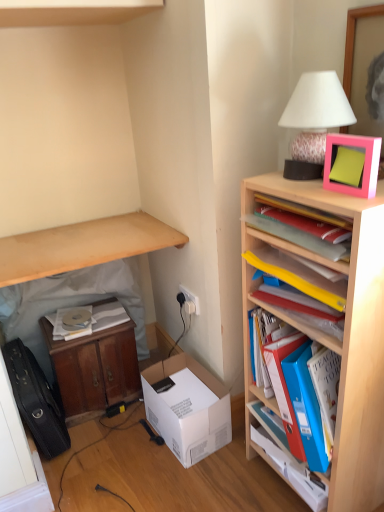
What do you see at coordinates (35, 400) in the screenshot? Image resolution: width=384 pixels, height=512 pixels. I see `black leather suitcase at lower left` at bounding box center [35, 400].

You are a GUI agent. You are given a task and a screenshot of the screen. Output one action in this format:
    pyautogui.click(x=<x>, y=<y>)
    Task: Click on the white plastic electric outlet at center
    
    Given the screenshot: What is the action you would take?
    (x=191, y=297)

What is the approximate height of yellow plastic folders at upper right, which appears as the 1th shelf when viewed from the top?

It is 3.14 inches.

The height and width of the screenshot is (512, 384). In order to click on wooden bookshelf at right, placed as the 2th shelf when sorted from top to bottom in this screenshot , I will do `click(344, 328)`.

From the image's perspective, does light wood shelf at upper left appear lower than blue plastic cabinet at right?

Actually, light wood shelf at upper left appears above blue plastic cabinet at right in the image.

Considering the positions of objects light wood shelf at upper left and blue plastic cabinet at right in the image provided, who is more to the right, light wood shelf at upper left or blue plastic cabinet at right?

blue plastic cabinet at right.

Can you tell me how much light wood shelf at upper left and blue plastic cabinet at right differ in facing direction?

86.8 degrees separate the facing orientations of light wood shelf at upper left and blue plastic cabinet at right.

Choose the correct answer: Is light wood shelf at upper left inside blue plastic cabinet at right or outside it?

light wood shelf at upper left cannot be found inside blue plastic cabinet at right.

Is wooden cabinet at lower left, the 1th table when ordered from right to left, a part of wooden cabinet at lower left, which ranks as the first table in left-to-right order?

Yes, wooden cabinet at lower left, the 1th table when ordered from right to left, is inside wooden cabinet at lower left, which ranks as the first table in left-to-right order.

Is wooden cabinet at lower left, which ranks as the first table in left-to-right order, oriented away from wooden cabinet at lower left, which is counted as the second table, starting from the left?

Yes, wooden cabinet at lower left, which is counted as the second table, starting from the left, is at the back of wooden cabinet at lower left, which ranks as the first table in left-to-right order.

From a real-world perspective, is wooden cabinet at lower left, which ranks as the first table in left-to-right order, physically above wooden cabinet at lower left, the 1th table when ordered from right to left?

Yes, from a real-world perspective, wooden cabinet at lower left, which ranks as the first table in left-to-right order, is on top of wooden cabinet at lower left, the 1th table when ordered from right to left.

From their relative heights in the image, would you say wooden cabinet at lower left, which ranks as the first table in left-to-right order, is taller or shorter than wooden cabinet at lower left, which is counted as the second table, starting from the left?

Considering their sizes, wooden cabinet at lower left, which ranks as the first table in left-to-right order, has more height than wooden cabinet at lower left, which is counted as the second table, starting from the left.

From a real-world perspective, is wooden cabinet at lower left, the 1th table when ordered from right to left, below wooden cabinet at lower left, which ranks as the first table in left-to-right order?

Yes, from a real-world perspective, wooden cabinet at lower left, the 1th table when ordered from right to left, is under wooden cabinet at lower left, which ranks as the first table in left-to-right order.

Is wooden cabinet at lower left, the 1th table when ordered from right to left, shorter than wooden cabinet at lower left, which ranks as the first table in left-to-right order?

Yes, wooden cabinet at lower left, the 1th table when ordered from right to left, is shorter than wooden cabinet at lower left, which ranks as the first table in left-to-right order.

Can you confirm if wooden cabinet at lower left, the 1th table when ordered from right to left, is bigger than wooden cabinet at lower left, which ranks as the first table in left-to-right order?

No.

Considering the relative sizes of wooden cabinet at lower left, which is counted as the second table, starting from the left, and wooden cabinet at lower left, which ranks as the first table in left-to-right order, in the image provided, is wooden cabinet at lower left, which is counted as the second table, starting from the left, thinner than wooden cabinet at lower left, which ranks as the first table in left-to-right order,?

Incorrect, the width of wooden cabinet at lower left, which is counted as the second table, starting from the left, is not less than that of wooden cabinet at lower left, which ranks as the first table in left-to-right order.

Is white cardboard box at lower center touching blue plastic cabinet at right?

No, white cardboard box at lower center is not beside blue plastic cabinet at right.

Looking at this image, does white cardboard box at lower center have a greater height compared to blue plastic cabinet at right?

Yes.

The height and width of the screenshot is (512, 384). In order to click on box behind the blue plastic cabinet at right in this screenshot , I will do `click(187, 407)`.

Which of these two, white cardboard box at lower center or blue plastic cabinet at right, is bigger?

white cardboard box at lower center.

Based on the photo, how many degrees apart are the facing directions of white paper at lower left, arranged as the first book when ordered from the bottom, and white matte table lamp at upper right?

white paper at lower left, arranged as the first book when ordered from the bottom, and white matte table lamp at upper right are facing 85.4 degrees away from each other.

Is white paper at lower left, arranged as the first book when ordered from the bottom, in front of or behind white matte table lamp at upper right in the image?

white paper at lower left, arranged as the first book when ordered from the bottom, is positioned farther from the viewer than white matte table lamp at upper right.

In terms of height, does white paper at lower left, the 1th book when ordered from left to right, look taller or shorter compared to white matte table lamp at upper right?

In the image, white paper at lower left, the 1th book when ordered from left to right, appears to be shorter than white matte table lamp at upper right.

Consider the image. Does white paper at lower left, which ranks as the second book in front-to-back order, turn towards white matte table lamp at upper right?

No, white paper at lower left, which ranks as the second book in front-to-back order, is not facing towards white matte table lamp at upper right.

Which object is further away from the camera, blue plastic folders at right, which ranks as the first shelf in bottom-to-top order, or pink plastic frame at upper right, marked as the 2th book in a left-to-right arrangement?

blue plastic folders at right, which ranks as the first shelf in bottom-to-top order, is further from the camera.

Is pink plastic frame at upper right, which is the second book in bottom-to-top order, located within blue plastic folders at right, which appears as the 3th shelf when viewed from the top?

No, pink plastic frame at upper right, which is the second book in bottom-to-top order, is not a part of blue plastic folders at right, which appears as the 3th shelf when viewed from the top.

Find the location of a particular element. the 3rd shelf positioned below the pink plastic frame at upper right, the first book positioned from the right (from a real-world perspective) is located at coordinates (306, 406).

Is wooden cabinet at lower left, the 1th table when ordered from right to left, oriented towards pink matte picture frame at upper right?

No, wooden cabinet at lower left, the 1th table when ordered from right to left, is not aimed at pink matte picture frame at upper right.

Looking at this image, what's the angular difference between wooden cabinet at lower left, which is counted as the second table, starting from the left, and pink matte picture frame at upper right's facing directions?

wooden cabinet at lower left, which is counted as the second table, starting from the left, and pink matte picture frame at upper right are facing 84.1 degrees away from each other.

Is wooden cabinet at lower left, the 1th table when ordered from right to left, behind pink matte picture frame at upper right?

Yes, it is.

Looking at this image, would you say wooden cabinet at lower left, the 1th table when ordered from right to left, is inside or outside pink matte picture frame at upper right?

wooden cabinet at lower left, the 1th table when ordered from right to left, cannot be found inside pink matte picture frame at upper right.

You are a GUI agent. You are given a task and a screenshot of the screen. Output one action in this format:
    pyautogui.click(x=<x>, y=<y>)
    Task: Click on the desk that appears above the blue plastic cabinet at right (from the image's perspective)
    The image size is (384, 512).
    Given the screenshot: What is the action you would take?
    pos(82,246)

Identify the location of table on the left of the wooden cabinet at lower left, which is counted as the second table, starting from the left. (82, 245).

Estimate the real-world distances between objects in this image. Which object is further from white paper at lower left, the 2th book positioned from the top, blue plastic folders at right, which appears as the 3th shelf when viewed from the top, or pink matte picture frame at upper right?

pink matte picture frame at upper right is positioned further to the anchor white paper at lower left, the 2th book positioned from the top.

Based on their spatial positions, is blue plastic folders at right, which ranks as the first shelf in bottom-to-top order, or light wood shelf at upper left further from yellow plastic folders at upper right, which appears as the 3th shelf when ordered from the bottom?

Based on the image, light wood shelf at upper left appears to be further to yellow plastic folders at upper right, which appears as the 3th shelf when ordered from the bottom.

When comparing their distances from white paper at lower left, which ranks as the second book in front-to-back order, does light wood shelf at upper left or yellow plastic folders at upper right, which appears as the 1th shelf when viewed from the top, seem closer?

The object closer to white paper at lower left, which ranks as the second book in front-to-back order, is light wood shelf at upper left.

From the image, which object appears to be nearer to black leather suitcase at lower left, yellow plastic folders at upper right, which appears as the 1th shelf when viewed from the top, or pink matte picture frame at upper right?

Based on the image, yellow plastic folders at upper right, which appears as the 1th shelf when viewed from the top, appears to be nearer to black leather suitcase at lower left.

From the image, which object appears to be farther from blue plastic folders at right, which ranks as the first shelf in bottom-to-top order, white plastic electric outlet at center or white paper at lower left, the 2th book positioned from the top?

Based on the image, white paper at lower left, the 2th book positioned from the top, appears to be further to blue plastic folders at right, which ranks as the first shelf in bottom-to-top order.

Considering their positions, is pink matte picture frame at upper right positioned closer to wooden cabinet at lower left, the 1th table when ordered from right to left, than wooden cabinet at lower left, which ranks as the first table in left-to-right order?

wooden cabinet at lower left, which ranks as the first table in left-to-right order.

Which object lies further to the anchor point yellow plastic folders at upper right, which appears as the 3th shelf when ordered from the bottom, light wood shelf at upper left or black leather suitcase at lower left?

black leather suitcase at lower left.

From the image, which object appears to be nearer to white cardboard box at lower center, pink matte picture frame at upper right or yellow plastic folders at upper right, which appears as the 3th shelf when ordered from the bottom?

Among the two, yellow plastic folders at upper right, which appears as the 3th shelf when ordered from the bottom, is located nearer to white cardboard box at lower center.

Where is `book that lies between light wood shelf at upper left and wooden cabinet at lower left, positioned as the second table in right-to-left order, from top to bottom`? This screenshot has width=384, height=512. book that lies between light wood shelf at upper left and wooden cabinet at lower left, positioned as the second table in right-to-left order, from top to bottom is located at coordinates (89, 321).

Identify the location of book located between wooden cabinet at lower left, positioned as the second table in right-to-left order, and blue plastic cabinet at right in the left-right direction. The height and width of the screenshot is (512, 384). (89, 321).

This screenshot has height=512, width=384. I want to click on table lamp between light wood shelf at upper left and pink matte picture frame at upper right from left to right, so click(x=316, y=114).

Locate an element on the screen. The width and height of the screenshot is (384, 512). picture frame between white matte table lamp at upper right and pink plastic frame at upper right, the first book positioned from the right, in the vertical direction is located at coordinates (352, 164).